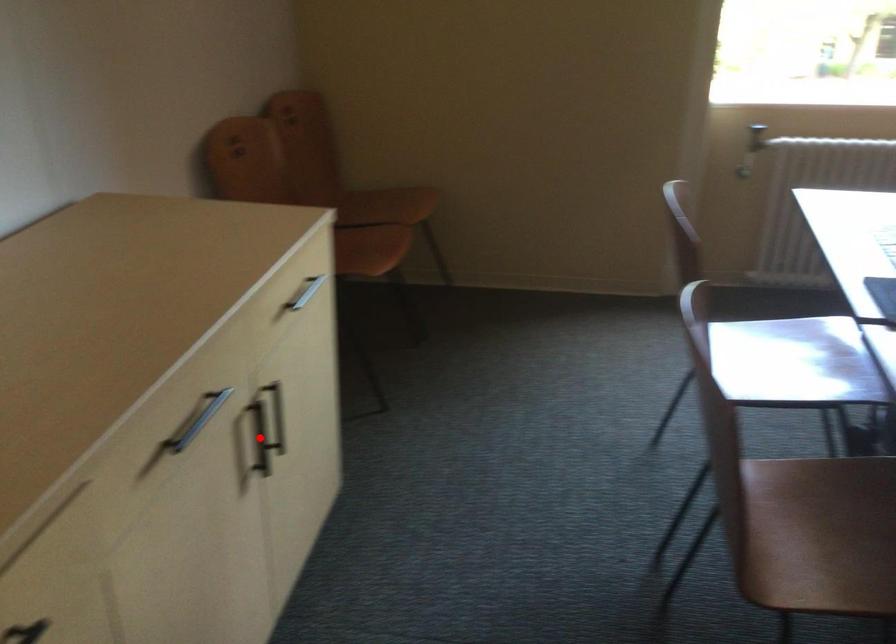
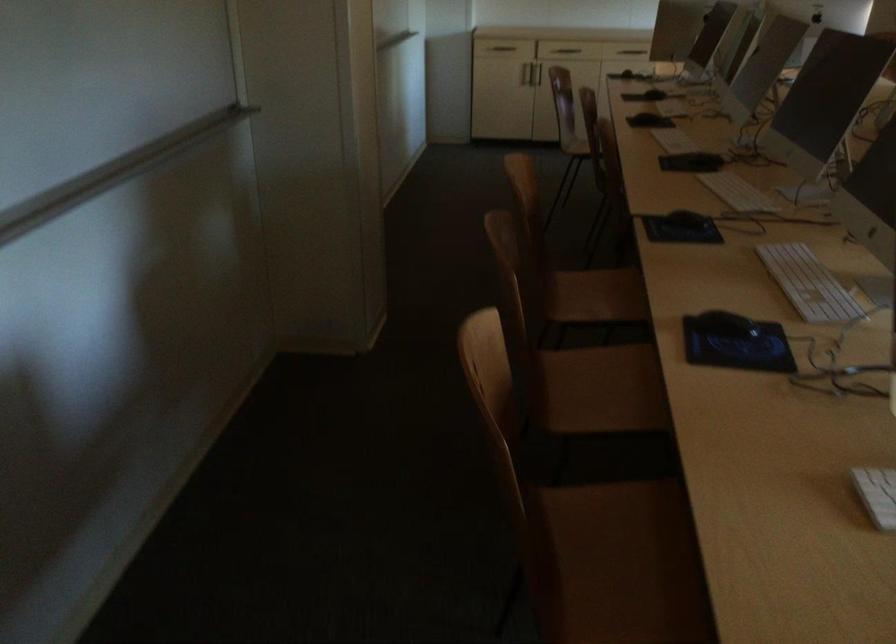
Question: I am providing you with two images of the same scene from different viewpoints. A red point is marked on the first image. At the location where the point appears in image 1, is it still visible in image 2?

Choices:
 (A) Yes
 (B) No

Answer: (B)